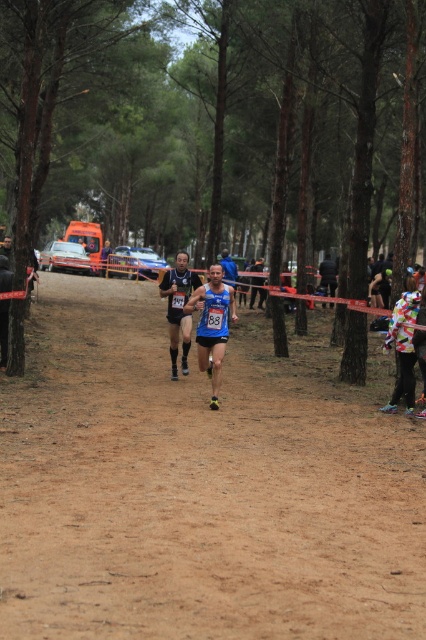
Who is higher up, blue fabric running suit at center or dark blue fabric runner at center?

Positioned higher is dark blue fabric runner at center.

Which is more to the left, blue fabric running suit at center or dark blue fabric runner at center?

blue fabric running suit at center is more to the left.

Identify the location of blue fabric running suit at center. The width and height of the screenshot is (426, 640). pyautogui.click(x=213, y=324).

In the scene shown: Does brown dirt track at center appear on the left side of blue fabric shirt at center?

Indeed, brown dirt track at center is positioned on the left side of blue fabric shirt at center.

Locate an element on the screen. brown dirt track at center is located at coordinates (201, 483).

Locate an element on the screen. brown dirt track at center is located at coordinates (201, 483).

Can you confirm if blue fabric running suit at center is positioned below multicolored fabric at right?

Incorrect, blue fabric running suit at center is not positioned below multicolored fabric at right.

Is point (218, 317) in front of point (396, 308)?

Yes, it is.

Image resolution: width=426 pixels, height=640 pixels. What are the coordinates of `blue fabric running suit at center` in the screenshot? It's located at (213, 324).